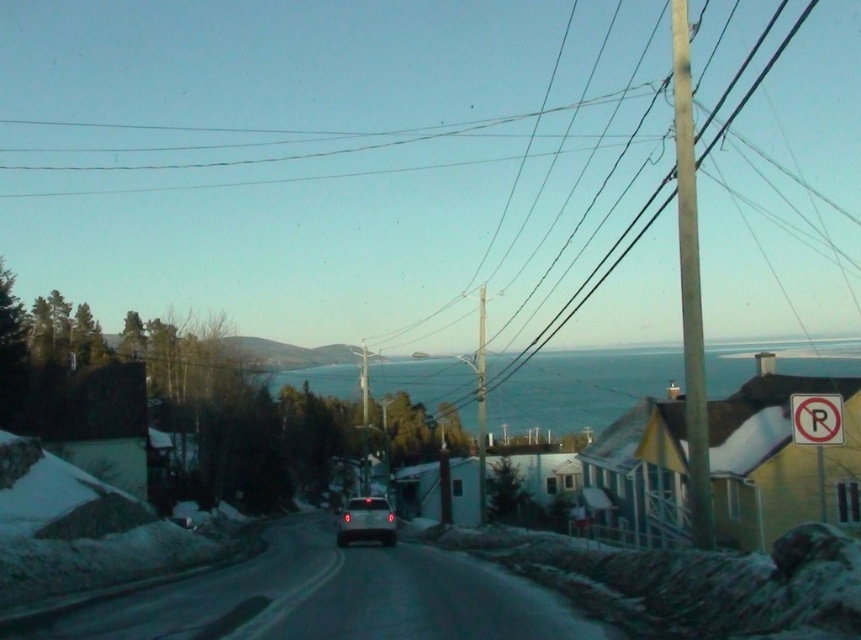
You are a delivery driver approaching the road in the winter scene. You need to park your vehicle but see the white plastic no parking sign at upper right. Based on its position, can you park directly in front of the sign?

The white plastic no parking sign at upper right is located at point (816, 419), which likely indicates it is positioned near the edge of the road. Since parking directly in front of such signs is typically prohibited, you should avoid parking there to comply with local regulations.

You are driving a car and see the smooth wooden pole at right and the satin silver sedan at center. Which object is nearer to you?

The smooth wooden pole at right is closer to the viewer than the satin silver sedan at center.